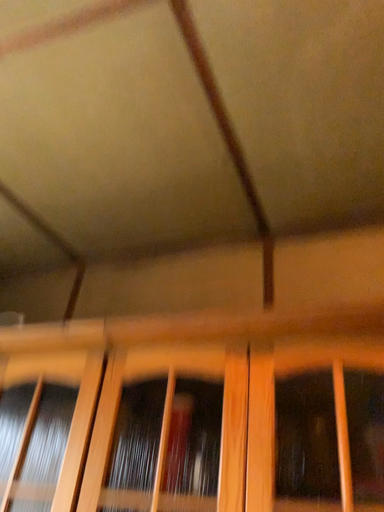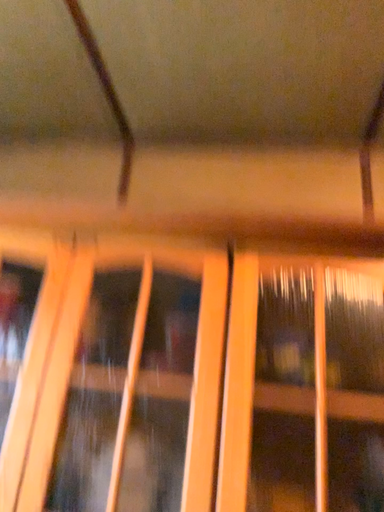
Question: How did the camera likely rotate when shooting the video?

Choices:
 (A) rotated right
 (B) rotated left

Answer: (A)